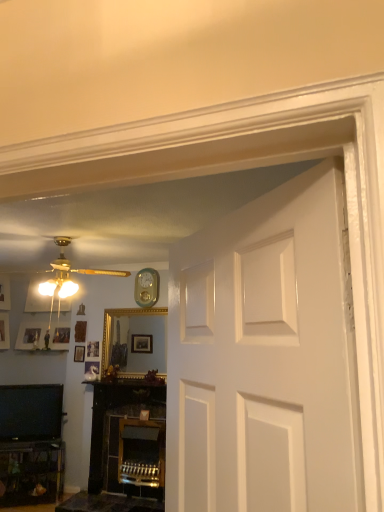
Question: In the image, is gold metallic ceiling fan at upper left on the left side or the right side of wooden picture frame at center?

Choices:
 (A) left
 (B) right

Answer: (B)

Question: Is gold metallic ceiling fan at upper left in front of or behind wooden picture frame at center in the image?

Choices:
 (A) front
 (B) behind

Answer: (A)

Question: Which is farther from the wooden picture frame at center?

Choices:
 (A) black glossy television at lower left
 (B) matte gold ceiling fan at upper left
 (C) teal glossy clock at upper center
 (D) gold metallic ceiling fan at upper left

Answer: (B)

Question: Based on their relative distances, which object is nearer to the matte gold ceiling fan at upper left?

Choices:
 (A) teal glossy clock at upper center
 (B) gold metallic ceiling fan at upper left
 (C) wooden picture frame at center
 (D) black glossy television at lower left

Answer: (B)